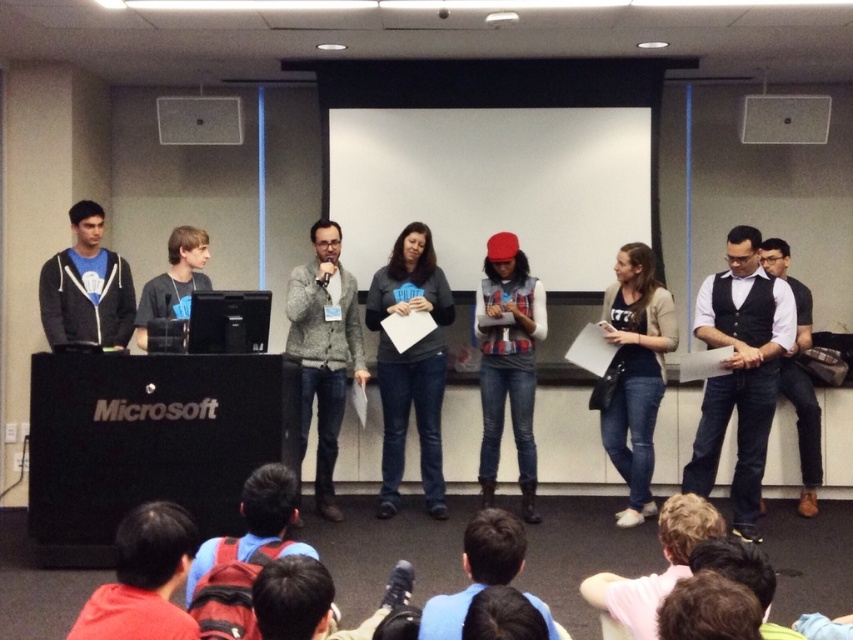
In the scene shown: You are organizing a photo shoot for a clothing brand and need to arrange two models wearing the gray sweater at center and white shirt at center. According to the scene, which clothing item is more suitable for a model with a smaller frame?

The gray sweater at center has a smaller size compared to the white shirt at center, so it is more suitable for a model with a smaller frame.

You are an event organizer and need to place a name tag on the podium for the presenter wearing the gray sweater at center. Based on their position, where should you place the name tag on the podium?

The gray sweater at center is located at point (410, 365), so the name tag should be placed at the center of the podium to match their position.